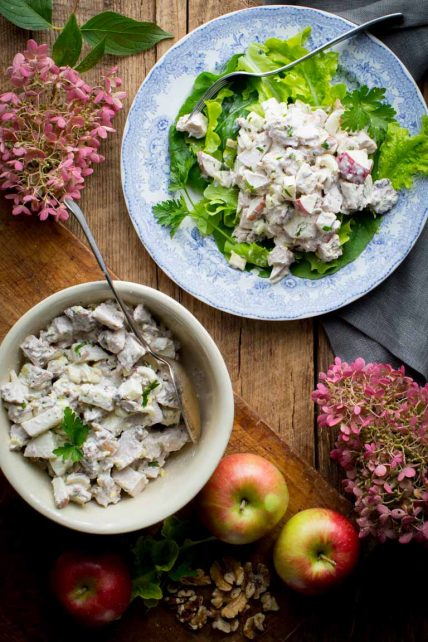
The image size is (428, 642). In order to click on wooden table in this screenshot , I will do `click(329, 498)`.